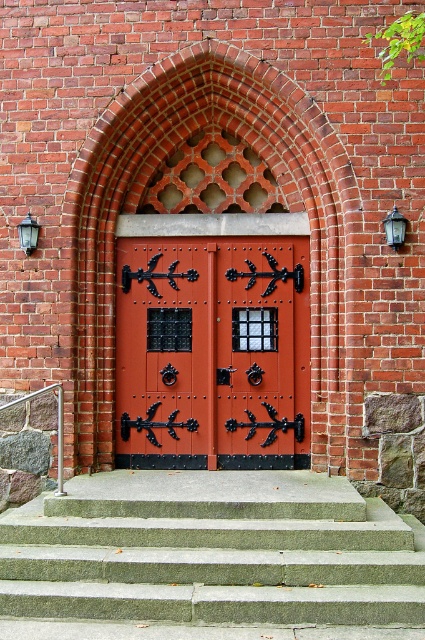
You are an architect examining the building facade. You need to determine which object is taller between the red brick archway at center and the metallic silver railing at lower left. Based on the scene description, which one is taller?

The red brick archway at center is taller than the metallic silver railing at lower left according to the description.